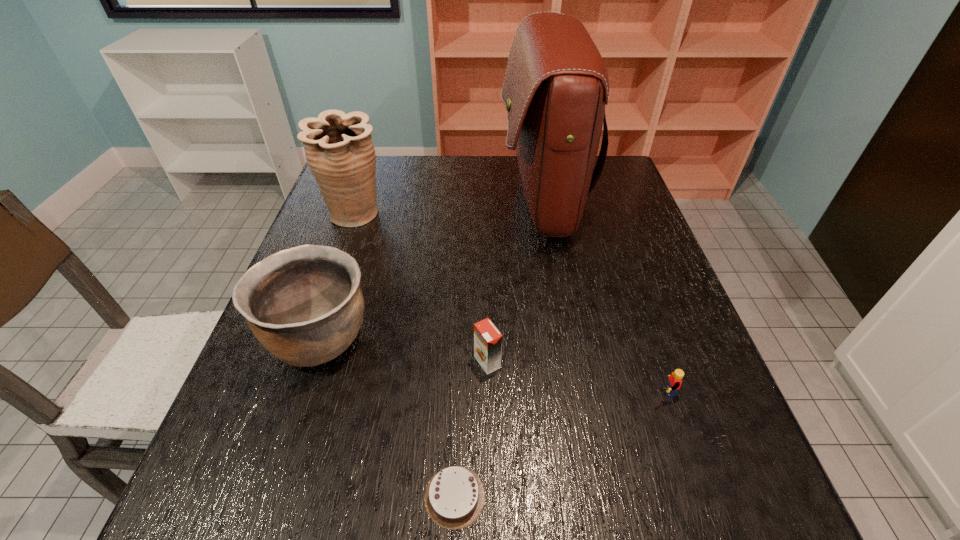
Find the location of `free space at the far right corner of the desktop`. free space at the far right corner of the desktop is located at coordinates (618, 173).

This screenshot has width=960, height=540. In order to click on vacant region at the near right corner of the desktop in this screenshot , I will do `click(719, 500)`.

Locate an element on the screen. The height and width of the screenshot is (540, 960). free spot between the rightmost object and the nearest object is located at coordinates (558, 444).

This screenshot has width=960, height=540. What are the coordinates of `vacant region between the fifth shortest object and the tallest object` in the screenshot? It's located at (448, 207).

Identify the location of free spot between the orange juice and the Lego. This screenshot has width=960, height=540. (574, 377).

Find the location of a particular element. This screenshot has width=960, height=540. free spot between the Lego and the fifth shortest object is located at coordinates (508, 303).

Locate an element on the screen. This screenshot has width=960, height=540. free space between the orange juice and the fifth shortest object is located at coordinates (421, 288).

This screenshot has width=960, height=540. I want to click on empty location between the fourth shortest object and the satchel, so click(430, 269).

You are a GUI agent. You are given a task and a screenshot of the screen. Output one action in this format:
    pyautogui.click(x=<x>, y=<y>)
    Task: Click on the free space between the satchel and the pottery
    The image size is (960, 540).
    Given the screenshot: What is the action you would take?
    pyautogui.click(x=430, y=269)

What are the coordinates of `empty space that is in between the orange juice and the urn` in the screenshot? It's located at (421, 288).